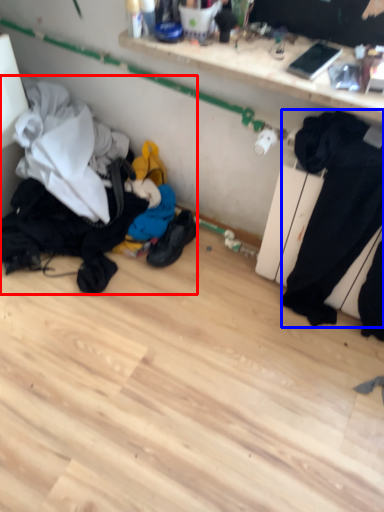
Question: Which point is closer to the camera, laundry (highlighted by a red box) or sweat pant (highlighted by a blue box)?

Choices:
 (A) laundry
 (B) sweat pant

Answer: (B)